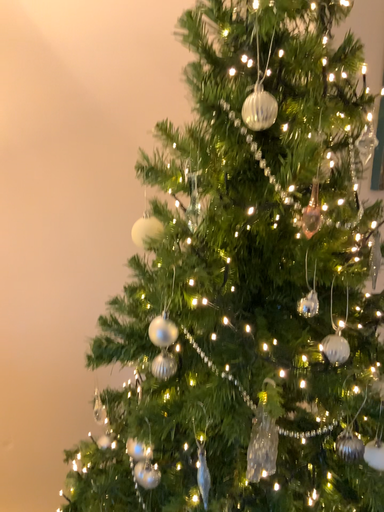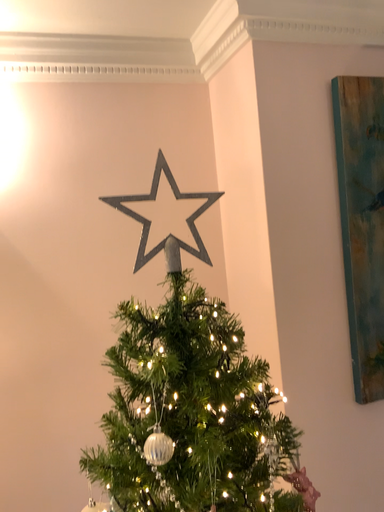
Question: How did the camera likely rotate when shooting the video?

Choices:
 (A) rotated downward
 (B) rotated upward

Answer: (B)